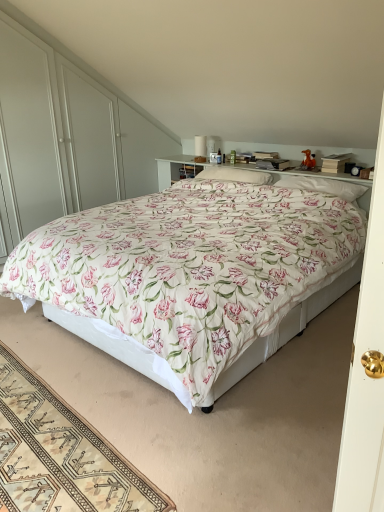
Question: Considering the positions of white soft pillow at upper center, acting as the second pillow starting from the left, and floral fabric bed at center in the image, is white soft pillow at upper center, acting as the second pillow starting from the left, taller or shorter than floral fabric bed at center?

Choices:
 (A) tall
 (B) short

Answer: (B)

Question: Looking at the image, does white soft pillow at upper center, acting as the second pillow starting from the left, seem bigger or smaller compared to floral fabric bed at center?

Choices:
 (A) big
 (B) small

Answer: (B)

Question: Estimate the real-world distances between objects in this image. Which object is closer to the white soft pillow at center, which ranks as the 2th pillow in right-to-left order?

Choices:
 (A) floral fabric bed at center
 (B) white glossy dresser at upper center
 (C) beige woven rug at lower left
 (D) white soft pillow at upper center, acting as the second pillow starting from the left

Answer: (D)

Question: Based on their relative distances, which object is nearer to the white soft pillow at upper center, acting as the second pillow starting from the left?

Choices:
 (A) white soft pillow at center, which ranks as the 2th pillow in right-to-left order
 (B) floral fabric bed at center
 (C) white glossy dresser at upper center
 (D) beige woven rug at lower left

Answer: (A)